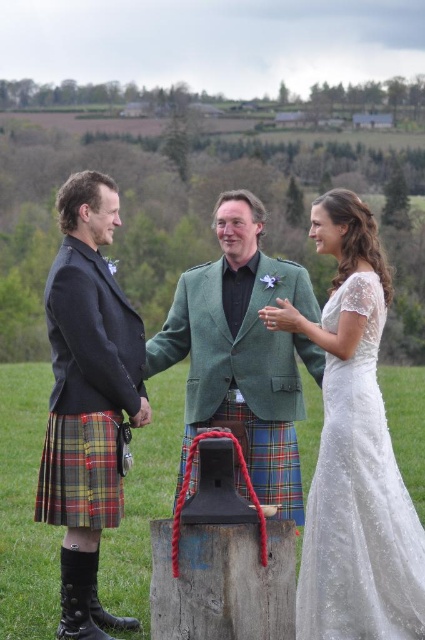
How distant is plaid wool kilt at center from white lace dress at right?

plaid wool kilt at center and white lace dress at right are 2.57 meters apart from each other.

Based on the photo, is the position of plaid wool kilt at center less distant than that of white lace dress at right?

No, plaid wool kilt at center is behind white lace dress at right.

Identify the location of plaid wool kilt at center. (87, 397).

At what (x,y) coordinates should I click in order to perform the action: click on plaid wool kilt at center. Please return your answer as a coordinate pair (x, y). This screenshot has height=640, width=425. Looking at the image, I should click on coord(87,397).

Is point (79, 275) positioned behind point (190, 436)?

That is False.

Describe the element at coordinates (87, 397) in the screenshot. I see `plaid wool kilt at center` at that location.

You are a GUI agent. You are given a task and a screenshot of the screen. Output one action in this format:
    pyautogui.click(x=<x>, y=<y>)
    Task: Click on the plaid wool kilt at center
    This screenshot has height=640, width=425.
    Given the screenshot: What is the action you would take?
    [x=87, y=397]

Which is behind, point (379, 416) or point (223, 416)?

The point (223, 416) is behind.

Find the location of a particular element. The image size is (425, 640). white lace dress at right is located at coordinates (359, 499).